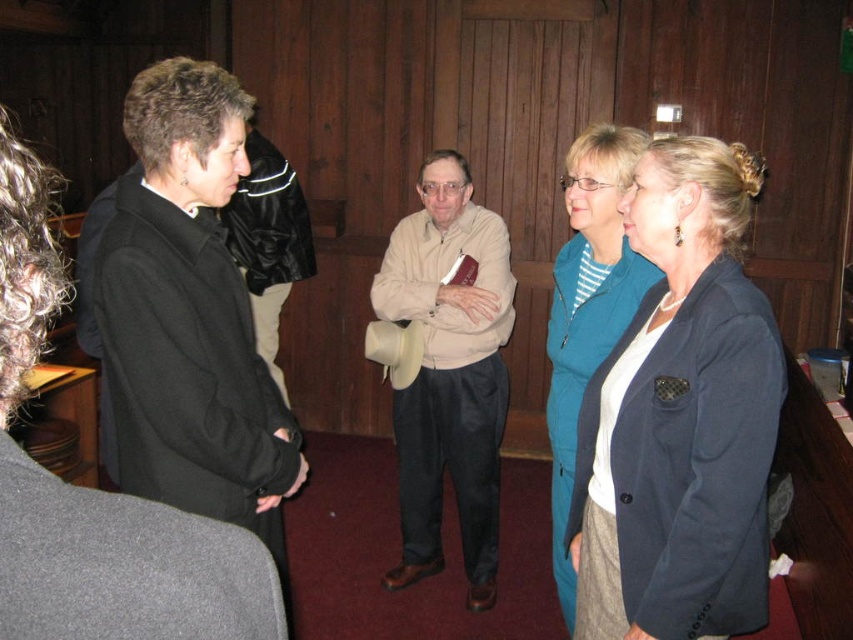
Does point (202, 113) come in front of point (581, 138)?

Yes.

Between black woolen jacket at left and teal fabric jacket at center, which one appears on the left side from the viewer's perspective?

→ black woolen jacket at left is more to the left.

I want to click on black woolen jacket at left, so click(x=189, y=316).

Which is behind, point (752, 168) or point (567, 308)?

The point (567, 308) is more distant.

Does point (729, 435) come behind point (582, 369)?

No, it is not.

Identify the location of navy blue blazer at center. (682, 417).

In order to click on navy blue blazer at center in this screenshot , I will do `click(682, 417)`.

Is navy blue blazer at center wider than beige fabric sweater at center?

In fact, navy blue blazer at center might be narrower than beige fabric sweater at center.

Between point (701, 280) and point (461, 392), which one is positioned behind?

The point (461, 392) is more distant.

Who is more distant from viewer, (668, 296) or (479, 360)?

Positioned behind is point (479, 360).

Find the location of a particular element. navy blue blazer at center is located at coordinates (682, 417).